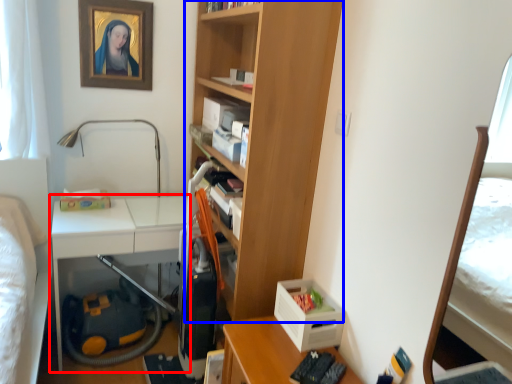
Question: Which object is closer to the camera taking this photo, table (highlighted by a red box) or bookcase (highlighted by a blue box)?

Choices:
 (A) table
 (B) bookcase

Answer: (B)